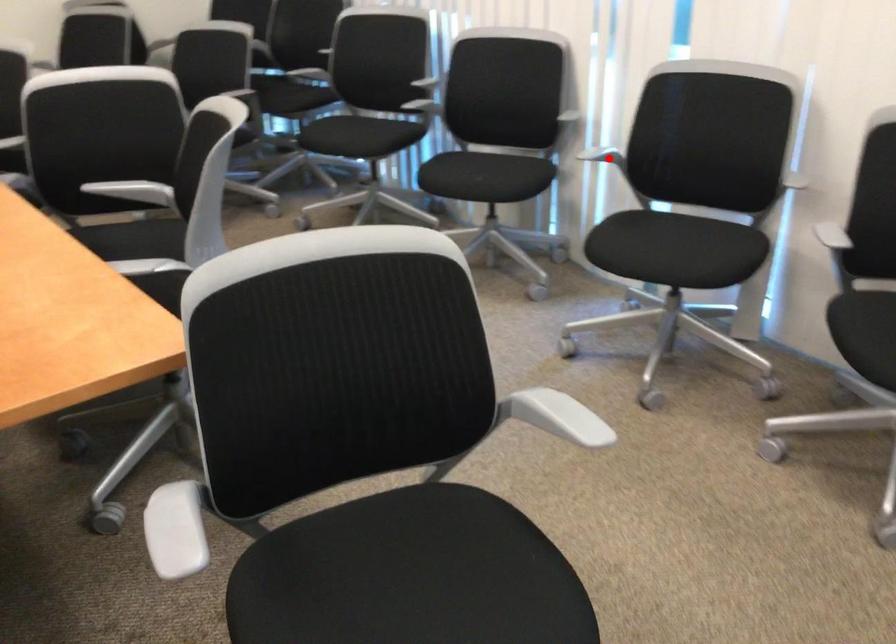
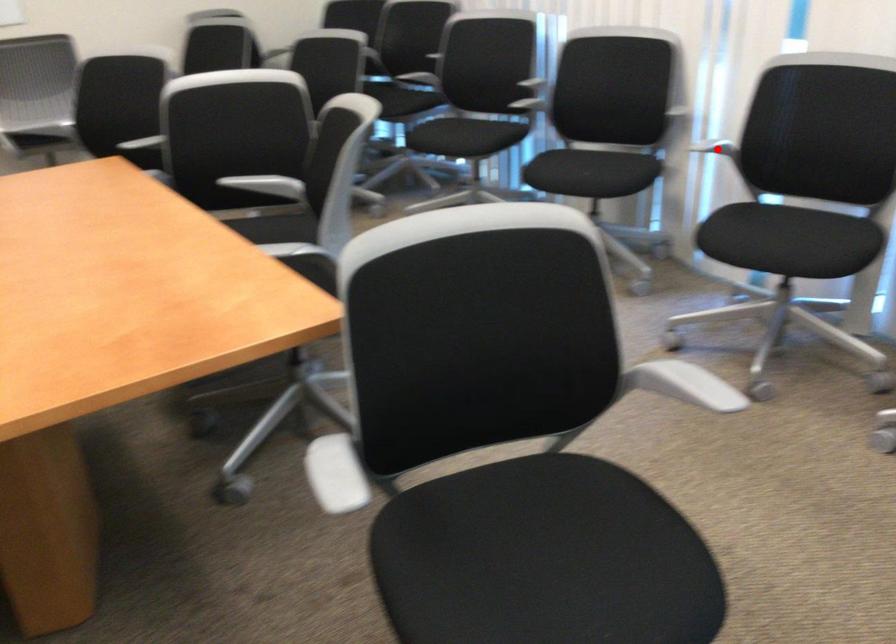
I am providing you with two images of the same scene from different viewpoints. A red point is marked on the first image and another point is marked on the second image. Do the highlighted points in image1 and image2 indicate the same real-world spot?

Yes